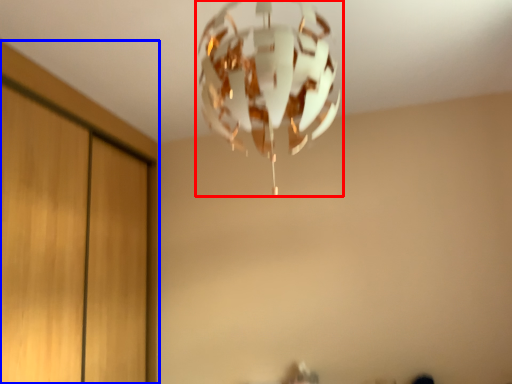
Question: Which object appears farthest to the camera in this image, lamp (highlighted by a red box) or dresser (highlighted by a blue box)?

Choices:
 (A) lamp
 (B) dresser

Answer: (B)